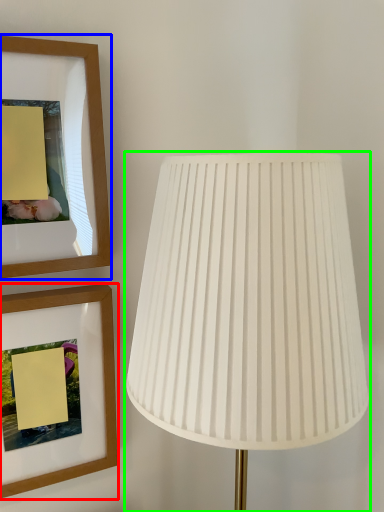
Question: Which is nearer to the picture frame (highlighted by a red box)? picture frame (highlighted by a blue box) or lamp (highlighted by a green box).

Choices:
 (A) picture frame
 (B) lamp

Answer: (A)